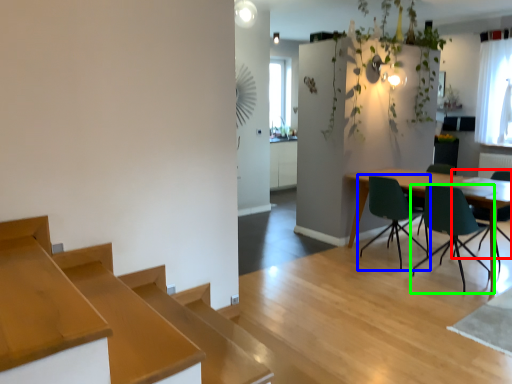
Question: Based on their relative distances, which object is farther from chair (highlighted by a red box)? Choose from chair (highlighted by a blue box) and chair (highlighted by a green box).

Choices:
 (A) chair
 (B) chair

Answer: (A)